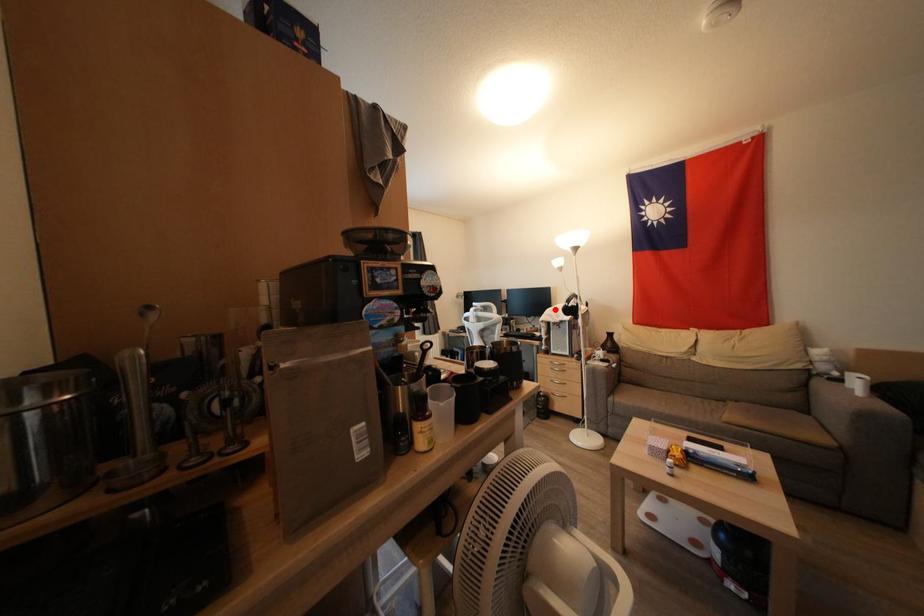
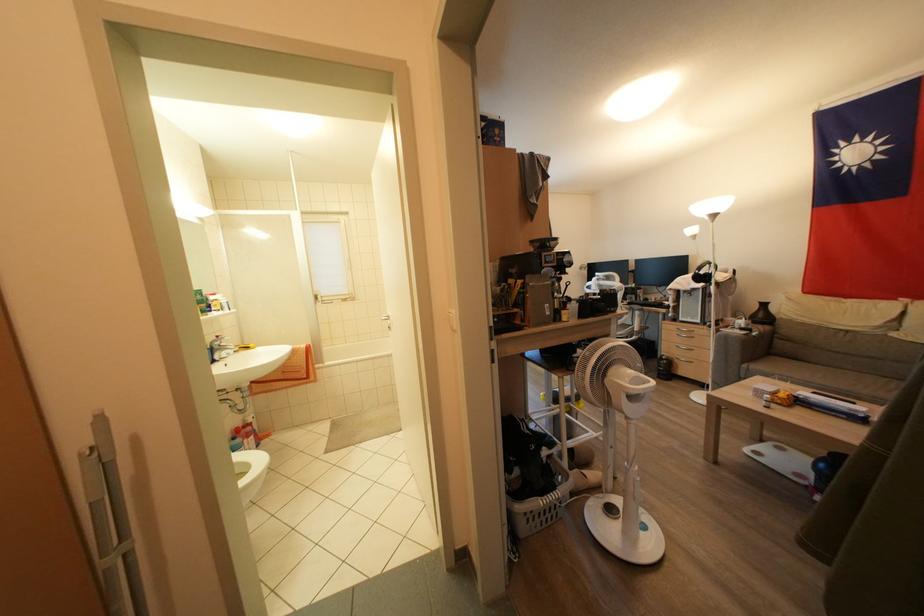
Find the pixel in the second image that matches the highlighted location in the first image.

(689, 278)